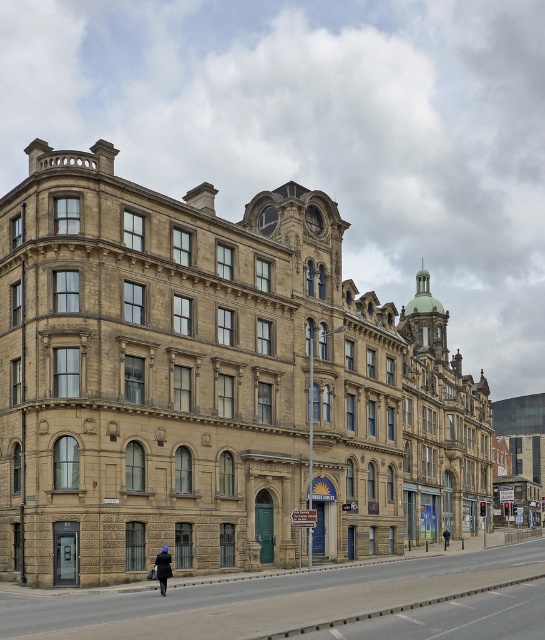
Is dark blue fabric coat at lower center positioned at the back of black fabric jacket at center?

That is False.

Can you confirm if dark blue fabric coat at lower center is smaller than black fabric jacket at center?

Yes, dark blue fabric coat at lower center is smaller than black fabric jacket at center.

Between point (161, 593) and point (447, 532), which one is positioned in front?

Point (161, 593)

The width and height of the screenshot is (545, 640). What are the coordinates of `dark blue fabric coat at lower center` in the screenshot? It's located at (162, 568).